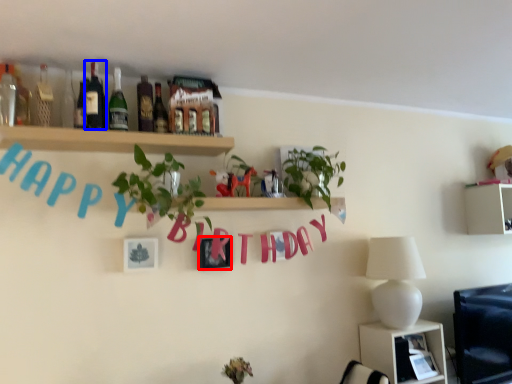
Question: Which of the following is the farthest to the observer, picture frame (highlighted by a red box) or bottle (highlighted by a blue box)?

Choices:
 (A) picture frame
 (B) bottle

Answer: (A)